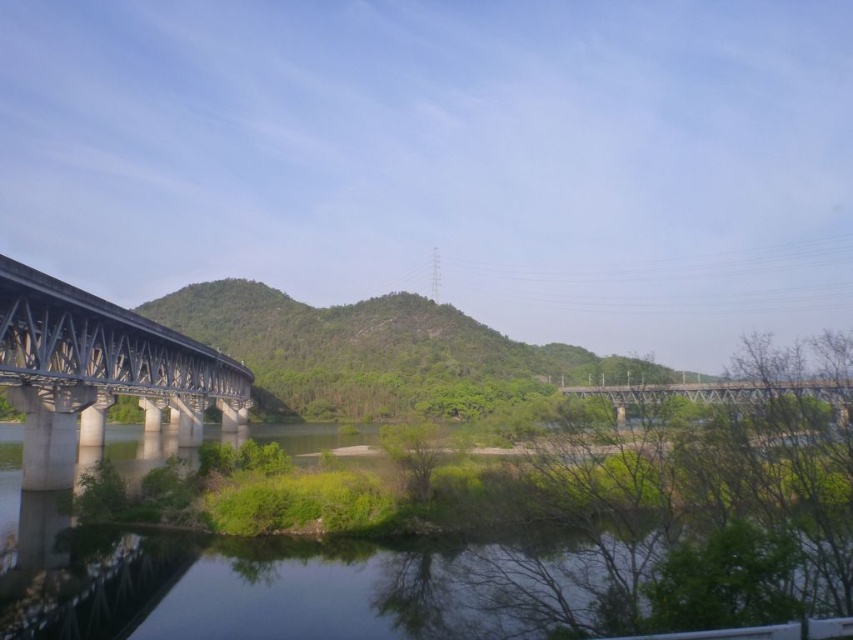
Looking at this image, can you confirm if clear water at lower left is positioned to the right of metallic gray bridge at center?

In fact, clear water at lower left is to the left of metallic gray bridge at center.

Which is above, clear water at lower left or metallic gray bridge at center?

clear water at lower left is above.

At what (x,y) coordinates should I click in order to perform the action: click on clear water at lower left. Please return your answer as a coordinate pair (x, y). The height and width of the screenshot is (640, 853). Looking at the image, I should click on (x=399, y=588).

Is point (299, 593) positioned in front of point (33, 396)?

Yes.

Does clear water at lower left appear on the right side of concrete bridge at left?

Yes, clear water at lower left is to the right of concrete bridge at left.

Who is more forward, (123, 628) or (90, 378)?

Point (123, 628) is in front.

The image size is (853, 640). In order to click on clear water at lower left in this screenshot , I will do `click(399, 588)`.

The image size is (853, 640). In order to click on concrete bridge at left in this screenshot , I will do click(x=97, y=369).

Which of these two, concrete bridge at left or metallic gray bridge at center, stands taller?

concrete bridge at left is taller.

Who is more forward, (x=47, y=420) or (x=822, y=392)?

Positioned in front is point (x=822, y=392).

Locate an element on the screen. This screenshot has height=640, width=853. concrete bridge at left is located at coordinates (97, 369).